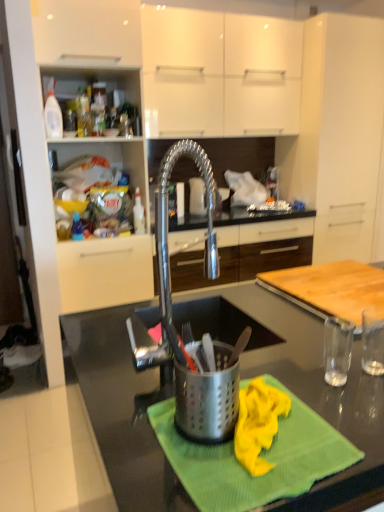
Where is `free space behind green textured cloth at center`? free space behind green textured cloth at center is located at coordinates (256, 361).